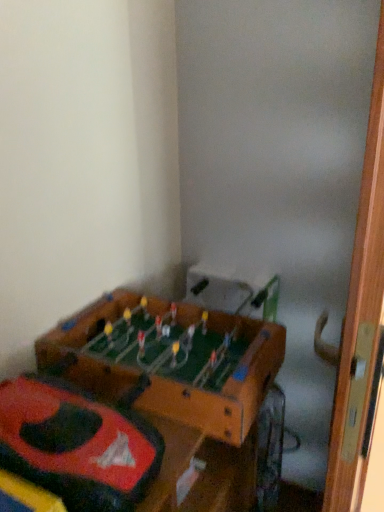
Question: From a real-world perspective, is wooden foosball table at lower left positioned above or below wooden door at right?

Choices:
 (A) below
 (B) above

Answer: (B)

Question: Visually, is wooden foosball table at lower left positioned to the left or to the right of wooden door at right?

Choices:
 (A) left
 (B) right

Answer: (A)

Question: Which of these objects is positioned closest to the wooden foosball table at lower left?

Choices:
 (A) wooden door at right
 (B) rubberized red car at lower left

Answer: (B)

Question: Estimate the real-world distances between objects in this image. Which object is closer to the wooden door at right?

Choices:
 (A) wooden foosball table at lower left
 (B) rubberized red car at lower left

Answer: (B)